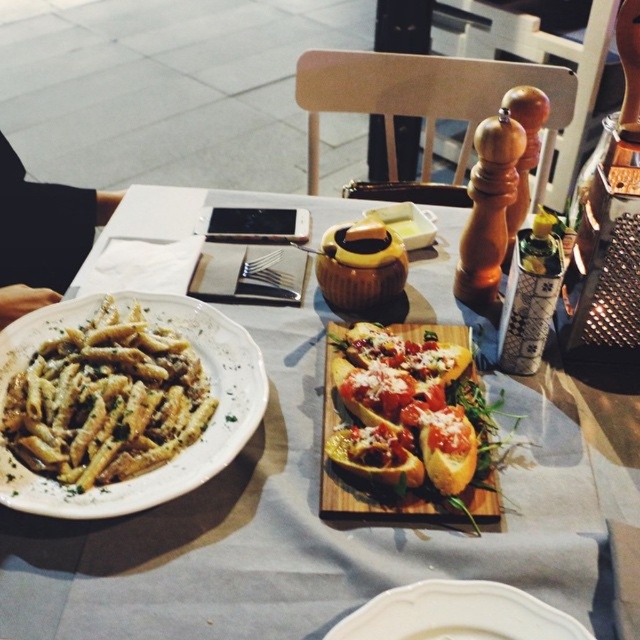
You are a server at the outdoor restaurant and need to place a new dessert plate between the white ceramic plate at center and the golden brown crusty bread at center. Which object should you move to make space?

The golden brown crusty bread at center is larger, so you should move it to make space for the new dessert plate between the white ceramic plate at center and the golden brown crusty bread at center.

You are a server at an outdoor restaurant and need to place a new dish on the table. You see the white ceramic plate at left and the white ceramic plate at center. Which plate is located to the left of the other?

The white ceramic plate at left is positioned on the left side of the white ceramic plate at center.

You are a waiter standing at the edge of the table, and you need to place a 12 inch wide dessert plate between the black fabric at upper left and the viewer. Can you fit it there?

The distance between the black fabric at upper left and the viewer is 37.92 inches. Since the dessert plate is only 12 inches wide, there is sufficient space to place it there.